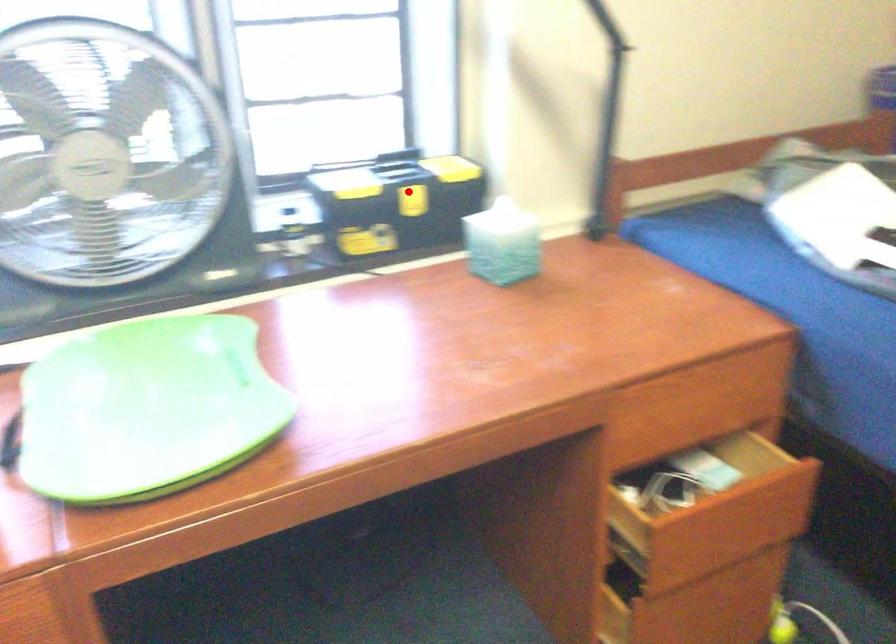
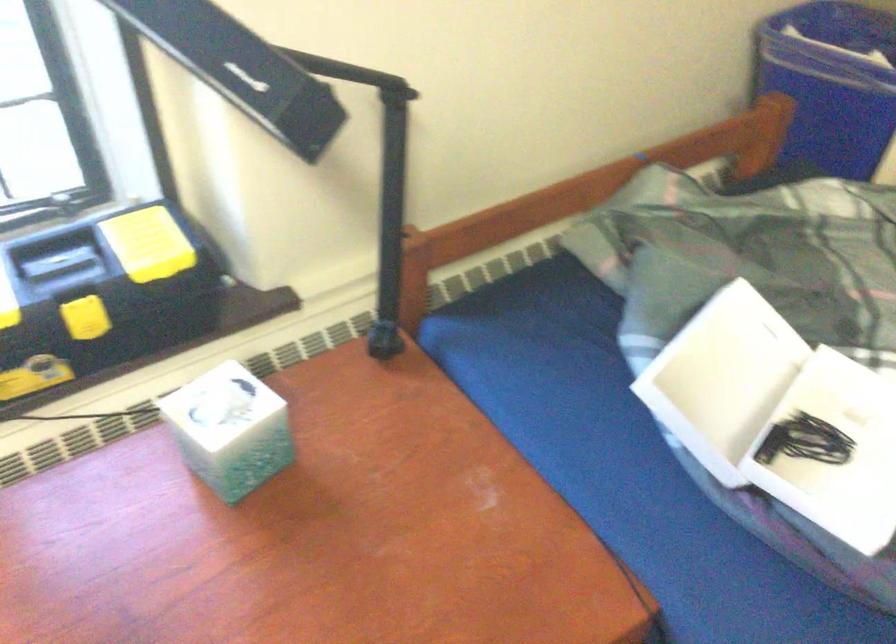
In the second image, find the point that corresponds to the highlighted location in the first image.

(83, 314)